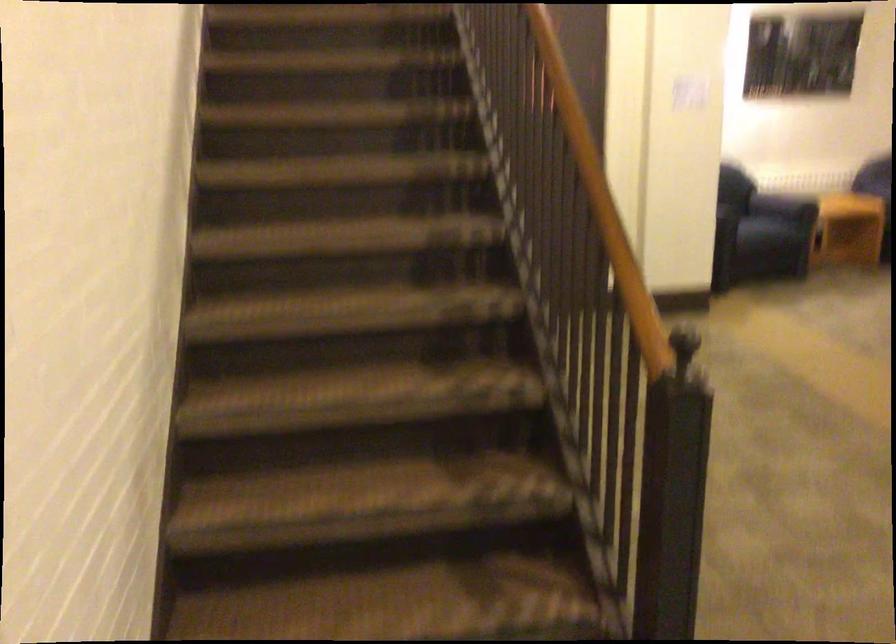
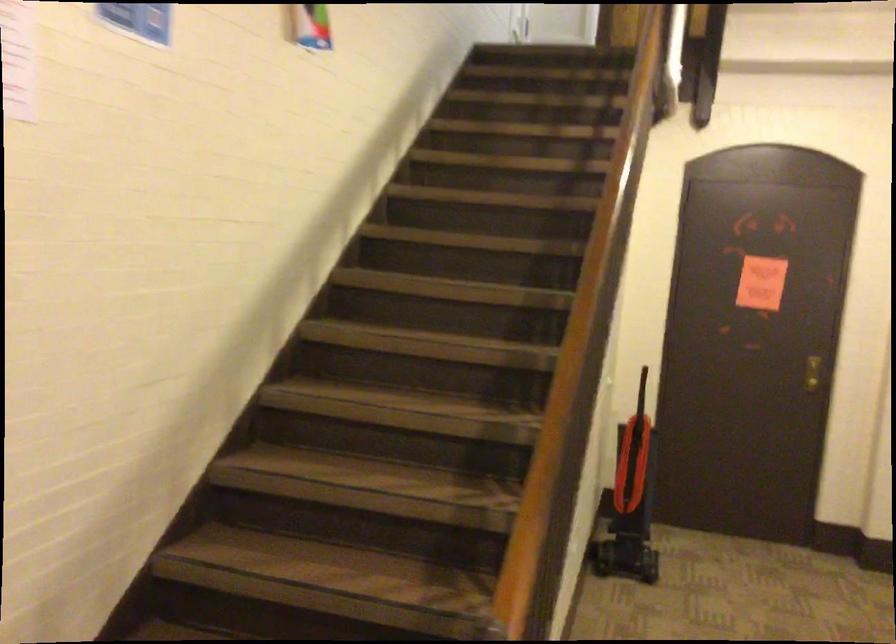
Question: The camera is either moving clockwise (left) or counter-clockwise (right) around the object. The first image is from the beginning of the video and the second image is from the end. Is the camera moving left or right when shooting the video?

Choices:
 (A) Left
 (B) Right

Answer: (B)